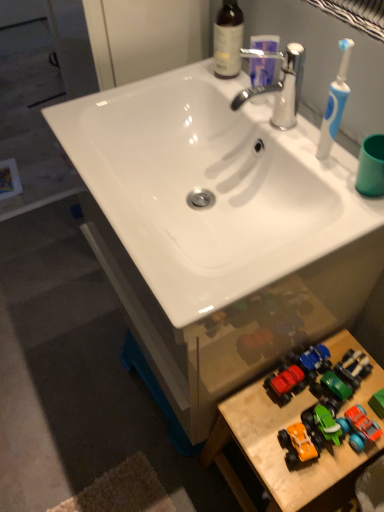
At what (x,y) coordinates should I click in order to perform the action: click on unoccupied area in front of chrome metallic faucet at upper center. Please return your answer as a coordinate pair (x, y). Looking at the image, I should click on (312, 172).